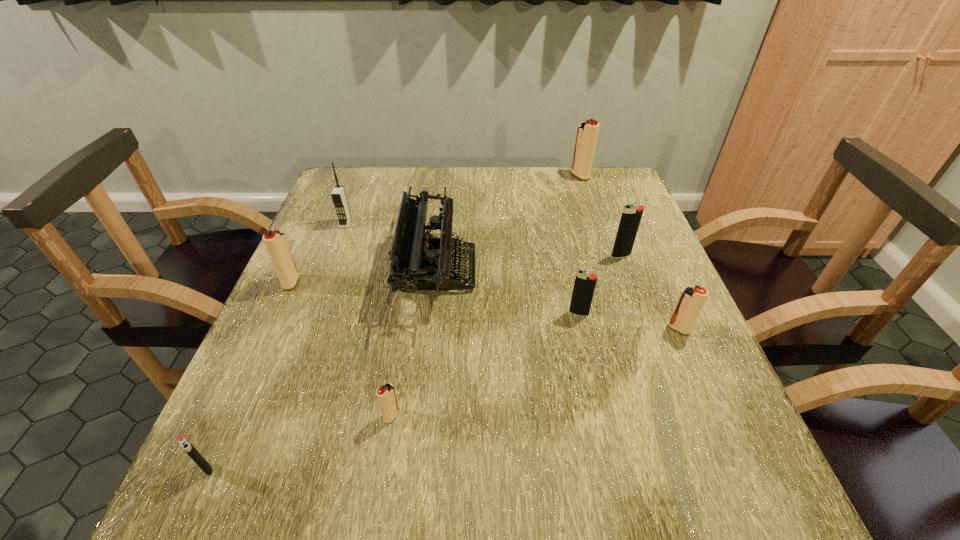
Identify which red igniter is the nearest to the biggest black igniter. Please provide its 2D coordinates. Your answer should be formatted as a tuple, i.e. [(x, y)], where the tuple contains the x and y coordinates of a point satisfying the conditions above.

[(691, 300)]

At what (x,y) coordinates should I click in order to perform the action: click on black igniter object that ranks as the closest to the biggest red igniter. Please return your answer as a coordinate pair (x, y). This screenshot has width=960, height=540. Looking at the image, I should click on (631, 216).

Identify which black igniter is the second closest to the fifth igniter from right to left. Please provide its 2D coordinates. Your answer should be formatted as a tuple, i.e. [(x, y)], where the tuple contains the x and y coordinates of a point satisfying the conditions above.

[(584, 286)]

This screenshot has height=540, width=960. Find the location of `vacant space that satisfies the following two spatial constraints: 1. on the front-facing side of the cellular telephone; 2. on the left side of the second smallest red igniter`. vacant space that satisfies the following two spatial constraints: 1. on the front-facing side of the cellular telephone; 2. on the left side of the second smallest red igniter is located at coordinates (x=306, y=329).

I want to click on free spot that satisfies the following two spatial constraints: 1. on the typing side of the typewriter; 2. on the back side of the second smallest black igniter, so click(x=433, y=313).